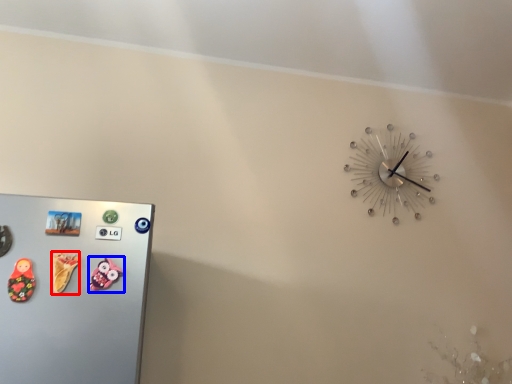
Question: Which object is closer to the camera taking this photo, toy (highlighted by a red box) or toy (highlighted by a blue box)?

Choices:
 (A) toy
 (B) toy

Answer: (A)